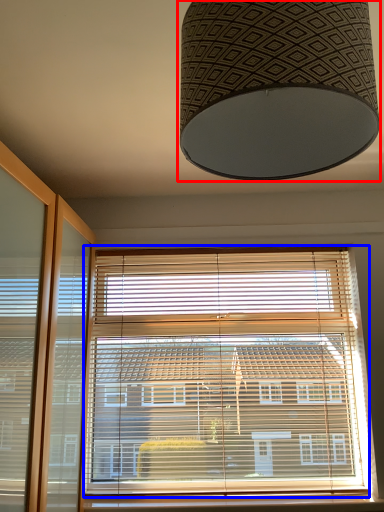
Question: Which object is further to the camera taking this photo, lamp (highlighted by a red box) or window blind (highlighted by a blue box)?

Choices:
 (A) lamp
 (B) window blind

Answer: (B)